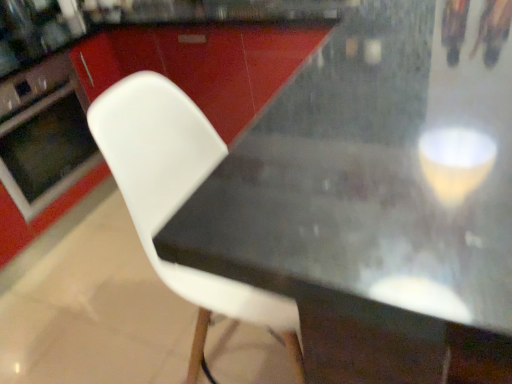
Question: Does point (286, 347) appear closer or farther from the camera than point (29, 114)?

Choices:
 (A) farther
 (B) closer

Answer: (B)

Question: Considering the positions of white plastic chair at center and matte black oven at left in the image, is white plastic chair at center wider or thinner than matte black oven at left?

Choices:
 (A) wide
 (B) thin

Answer: (B)

Question: Which object is the closest to the black matte table at center?

Choices:
 (A) matte black oven at left
 (B) white plastic chair at center

Answer: (B)

Question: Which is nearer to the black matte table at center?

Choices:
 (A) white plastic chair at center
 (B) matte black oven at left

Answer: (A)